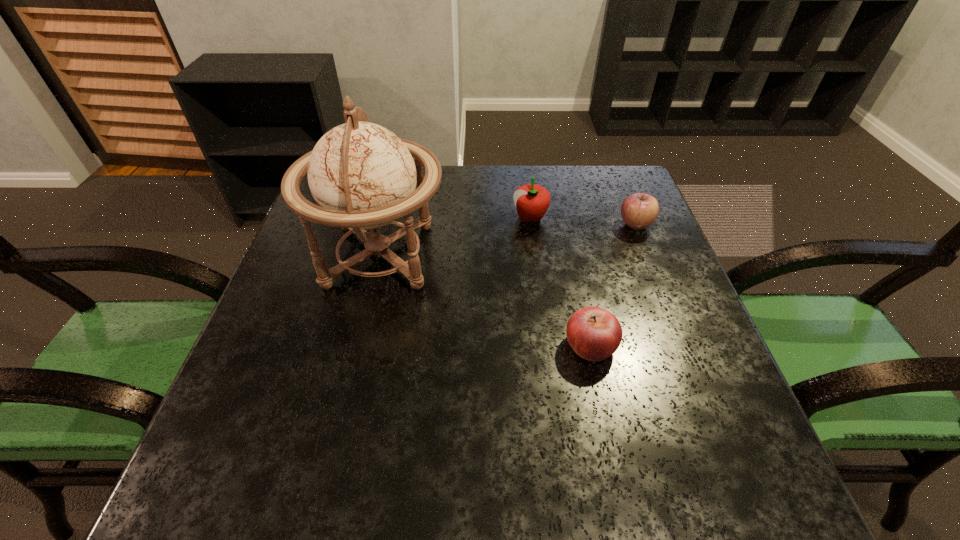
Locate an element on the screen. The width and height of the screenshot is (960, 540). vacant space at the far edge of the desktop is located at coordinates (432, 200).

Where is `blank space at the near edge`? The image size is (960, 540). blank space at the near edge is located at coordinates (460, 470).

The image size is (960, 540). I want to click on vacant area at the left edge, so click(x=329, y=237).

This screenshot has width=960, height=540. Identify the location of free location at the right edge. (632, 272).

Locate an element on the screen. This screenshot has height=540, width=960. vacant space at the near left corner of the desktop is located at coordinates (241, 469).

Where is `free location at the far right corner`? The image size is (960, 540). free location at the far right corner is located at coordinates (607, 173).

In the image, there is a desktop. At what (x,y) coordinates should I click in order to perform the action: click on vacant space at the near right corner. Please return your answer as a coordinate pair (x, y). Looking at the image, I should click on (721, 451).

The image size is (960, 540). Find the location of `free space between the rightmost apple and the globe`. free space between the rightmost apple and the globe is located at coordinates (508, 240).

Where is `blank region between the globe and the nearest apple`? blank region between the globe and the nearest apple is located at coordinates (485, 301).

Locate an element on the screen. The height and width of the screenshot is (540, 960). vacant space in between the rightmost object and the tallest object is located at coordinates (508, 240).